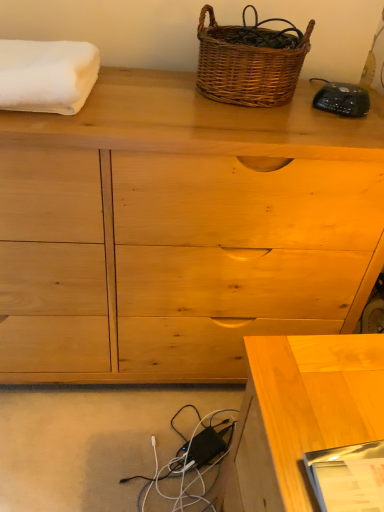
This screenshot has width=384, height=512. In order to click on empty space that is ontop of light wood desk at lower right (from a real-world perspective) in this screenshot , I will do `click(334, 393)`.